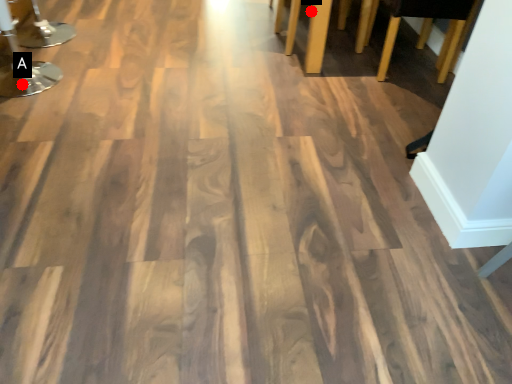
Question: Two points are circled on the image, labeled by A and B beside each circle. Which of the following is the farthest from the observer?

Choices:
 (A) A is further
 (B) B is further

Answer: (B)